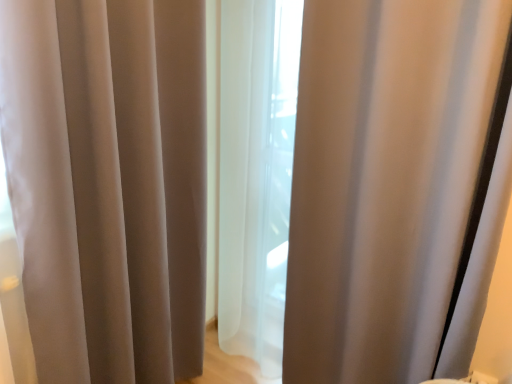
What is the approximate height of satin-like beige curtain at center, which ranks as the 2th curtain in left-to-right order?

5.16 feet.

In order to face satin-like beige curtain at center, which ranks as the 2th curtain in left-to-right order, should I rotate leftwards or rightwards?

Turn right approximately 10.290 degrees to face it.

Image resolution: width=512 pixels, height=384 pixels. Find the location of `satin-like beige curtain at center, which ranks as the 2th curtain in left-to-right order`. satin-like beige curtain at center, which ranks as the 2th curtain in left-to-right order is located at coordinates (384, 180).

The image size is (512, 384). What do you see at coordinates (384, 180) in the screenshot?
I see `satin-like beige curtain at center, which ranks as the 2th curtain in left-to-right order` at bounding box center [384, 180].

From the picture: In order to face satin beige curtain at center, the 2th curtain positioned from the right, should I rotate leftwards or rightwards?

Turn left by 17.458 degrees to look at satin beige curtain at center, the 2th curtain positioned from the right.

What do you see at coordinates (108, 183) in the screenshot?
I see `satin beige curtain at center, which is counted as the first curtain, starting from the left` at bounding box center [108, 183].

Image resolution: width=512 pixels, height=384 pixels. In order to click on satin beige curtain at center, which is counted as the first curtain, starting from the left in this screenshot , I will do `click(108, 183)`.

Image resolution: width=512 pixels, height=384 pixels. What are the coordinates of `satin-like beige curtain at center, which ranks as the 2th curtain in left-to-right order` in the screenshot? It's located at (384, 180).

Is satin beige curtain at center, the 2th curtain positioned from the right, at the right side of satin-like beige curtain at center, which ranks as the 2th curtain in left-to-right order?

In fact, satin beige curtain at center, the 2th curtain positioned from the right, is to the left of satin-like beige curtain at center, which ranks as the 2th curtain in left-to-right order.

Does satin beige curtain at center, which is counted as the first curtain, starting from the left, lie behind satin-like beige curtain at center, positioned as the first curtain in right-to-left order?

No, satin beige curtain at center, which is counted as the first curtain, starting from the left, is closer to the viewer.

Considering the positions of point (39, 364) and point (443, 91), is point (39, 364) closer or farther from the camera than point (443, 91)?

Clearly, point (39, 364) is closer to the camera than point (443, 91).

From the image's perspective, which one is positioned higher, satin beige curtain at center, the 2th curtain positioned from the right, or satin-like beige curtain at center, which ranks as the 2th curtain in left-to-right order?

satin-like beige curtain at center, which ranks as the 2th curtain in left-to-right order, is shown above in the image.

From a real-world perspective, who is located higher, satin beige curtain at center, the 2th curtain positioned from the right, or satin-like beige curtain at center, positioned as the first curtain in right-to-left order?

satin-like beige curtain at center, positioned as the first curtain in right-to-left order, from a real-world perspective.

Does satin beige curtain at center, the 2th curtain positioned from the right, have a greater width compared to satin-like beige curtain at center, positioned as the first curtain in right-to-left order?

In fact, satin beige curtain at center, the 2th curtain positioned from the right, might be narrower than satin-like beige curtain at center, positioned as the first curtain in right-to-left order.

Is satin beige curtain at center, the 2th curtain positioned from the right, taller than satin-like beige curtain at center, positioned as the first curtain in right-to-left order?

Incorrect, the height of satin beige curtain at center, the 2th curtain positioned from the right, is not larger of that of satin-like beige curtain at center, positioned as the first curtain in right-to-left order.

Does satin beige curtain at center, which is counted as the first curtain, starting from the left, have a larger size compared to satin-like beige curtain at center, positioned as the first curtain in right-to-left order?

No.

Is satin beige curtain at center, which is counted as the first curtain, starting from the left, located outside satin-like beige curtain at center, positioned as the first curtain in right-to-left order?

Absolutely, satin beige curtain at center, which is counted as the first curtain, starting from the left, is external to satin-like beige curtain at center, positioned as the first curtain in right-to-left order.

Based on the photo, is satin beige curtain at center, which is counted as the first curtain, starting from the left, next to satin-like beige curtain at center, positioned as the first curtain in right-to-left order?

No.

Is satin beige curtain at center, the 2th curtain positioned from the right, turned away from satin-like beige curtain at center, positioned as the first curtain in right-to-left order?

No.

How different are the orientations of satin beige curtain at center, which is counted as the first curtain, starting from the left, and satin-like beige curtain at center, positioned as the first curtain in right-to-left order, in degrees?

The angular difference between satin beige curtain at center, which is counted as the first curtain, starting from the left, and satin-like beige curtain at center, positioned as the first curtain in right-to-left order, is 87.6 degrees.

The width and height of the screenshot is (512, 384). Identify the location of curtain below the satin-like beige curtain at center, positioned as the first curtain in right-to-left order (from the image's perspective). pyautogui.click(x=108, y=183).

Considering the positions of objects satin-like beige curtain at center, positioned as the first curtain in right-to-left order, and satin beige curtain at center, which is counted as the first curtain, starting from the left, in the image provided, who is more to the right, satin-like beige curtain at center, positioned as the first curtain in right-to-left order, or satin beige curtain at center, which is counted as the first curtain, starting from the left,?

From the viewer's perspective, satin-like beige curtain at center, positioned as the first curtain in right-to-left order, appears more on the right side.

Considering the positions of objects satin-like beige curtain at center, which ranks as the 2th curtain in left-to-right order, and satin beige curtain at center, which is counted as the first curtain, starting from the left, in the image provided, who is in front, satin-like beige curtain at center, which ranks as the 2th curtain in left-to-right order, or satin beige curtain at center, which is counted as the first curtain, starting from the left,?

satin beige curtain at center, which is counted as the first curtain, starting from the left, is more forward.

Which is more distant, (422, 210) or (21, 228)?

The point (422, 210) is farther.

Consider the image. From the image's perspective, is satin-like beige curtain at center, which ranks as the 2th curtain in left-to-right order, above or below satin beige curtain at center, which is counted as the first curtain, starting from the left?

satin-like beige curtain at center, which ranks as the 2th curtain in left-to-right order, is situated higher than satin beige curtain at center, which is counted as the first curtain, starting from the left, in the image.

From a real-world perspective, is satin-like beige curtain at center, positioned as the first curtain in right-to-left order, positioned above or below satin beige curtain at center, which is counted as the first curtain, starting from the left?

From a real-world perspective, satin-like beige curtain at center, positioned as the first curtain in right-to-left order, is physically above satin beige curtain at center, which is counted as the first curtain, starting from the left.

Considering the sizes of objects satin-like beige curtain at center, positioned as the first curtain in right-to-left order, and satin beige curtain at center, which is counted as the first curtain, starting from the left, in the image provided, who is wider, satin-like beige curtain at center, positioned as the first curtain in right-to-left order, or satin beige curtain at center, which is counted as the first curtain, starting from the left,?

Wider between the two is satin-like beige curtain at center, positioned as the first curtain in right-to-left order.

Is satin-like beige curtain at center, which ranks as the 2th curtain in left-to-right order, taller or shorter than satin beige curtain at center, which is counted as the first curtain, starting from the left?

Considering their sizes, satin-like beige curtain at center, which ranks as the 2th curtain in left-to-right order, has more height than satin beige curtain at center, which is counted as the first curtain, starting from the left.

Who is bigger, satin-like beige curtain at center, positioned as the first curtain in right-to-left order, or satin beige curtain at center, the 2th curtain positioned from the right?

With larger size is satin-like beige curtain at center, positioned as the first curtain in right-to-left order.

Would you say satin-like beige curtain at center, which ranks as the 2th curtain in left-to-right order, is inside or outside satin beige curtain at center, which is counted as the first curtain, starting from the left?

satin-like beige curtain at center, which ranks as the 2th curtain in left-to-right order, is located beyond the bounds of satin beige curtain at center, which is counted as the first curtain, starting from the left.

Based on the photo, is there a large distance between satin-like beige curtain at center, which ranks as the 2th curtain in left-to-right order, and satin beige curtain at center, the 2th curtain positioned from the right?

They are positioned close to each other.

Is satin-like beige curtain at center, positioned as the first curtain in right-to-left order, facing towards satin beige curtain at center, the 2th curtain positioned from the right?

Yes, satin-like beige curtain at center, positioned as the first curtain in right-to-left order, faces towards satin beige curtain at center, the 2th curtain positioned from the right.

How many degrees apart are the facing directions of satin-like beige curtain at center, positioned as the first curtain in right-to-left order, and satin beige curtain at center, which is counted as the first curtain, starting from the left?

The angular difference between satin-like beige curtain at center, positioned as the first curtain in right-to-left order, and satin beige curtain at center, which is counted as the first curtain, starting from the left, is 87.6 degrees.

Measure the distance from satin-like beige curtain at center, which ranks as the 2th curtain in left-to-right order, to satin beige curtain at center, which is counted as the first curtain, starting from the left.

They are 23.96 inches apart.

The height and width of the screenshot is (384, 512). I want to click on curtain located in front of the satin-like beige curtain at center, which ranks as the 2th curtain in left-to-right order, so pos(108,183).

This screenshot has height=384, width=512. What are the coordinates of `curtain in front of the satin-like beige curtain at center, which ranks as the 2th curtain in left-to-right order` in the screenshot? It's located at (108, 183).

At what (x,y) coordinates should I click in order to perform the action: click on curtain lying on the left of satin-like beige curtain at center, which ranks as the 2th curtain in left-to-right order. Please return your answer as a coordinate pair (x, y). Looking at the image, I should click on (108, 183).